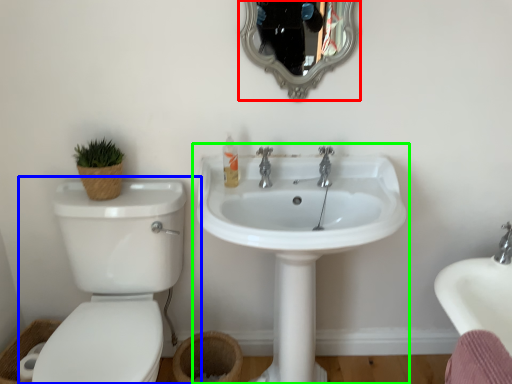
Question: Which object is positioned farthest from mirror (highlighted by a red box)? Select from toilet (highlighted by a blue box) and sink (highlighted by a green box).

Choices:
 (A) toilet
 (B) sink

Answer: (A)